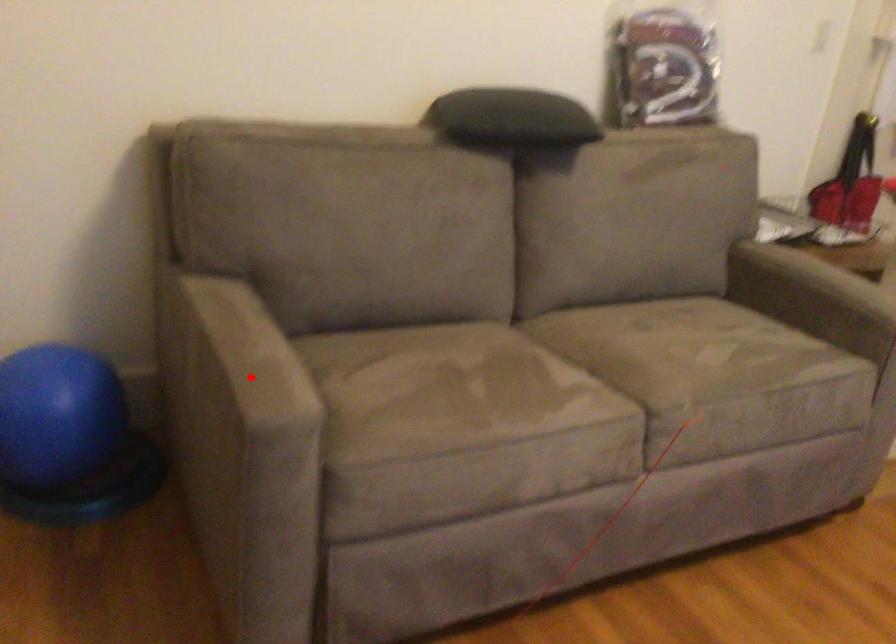
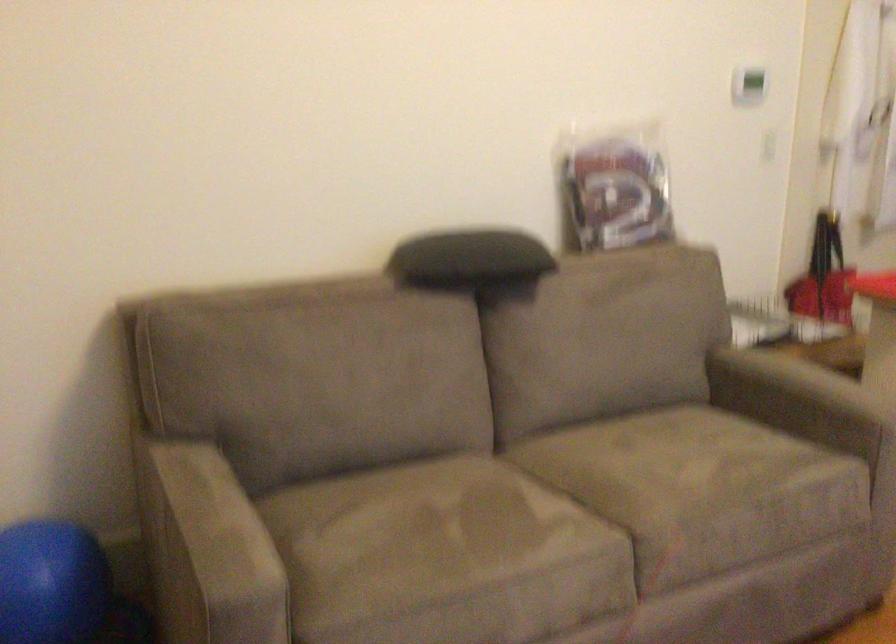
In the second image, find the point that corresponds to the highlighted location in the first image.

(209, 550)